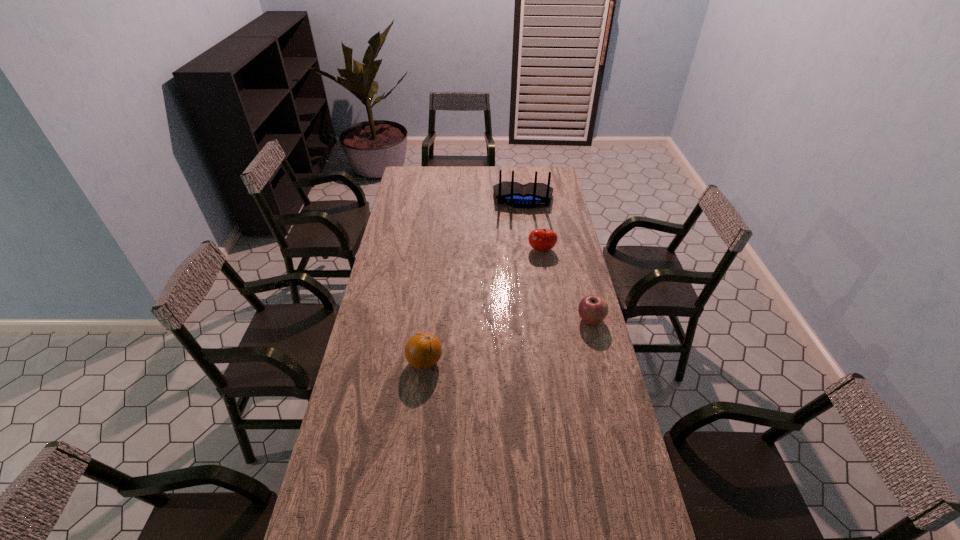
Locate an element on the screen. This screenshot has height=540, width=960. free spot located on the back of the farthest object is located at coordinates (522, 232).

Locate an element on the screen. Image resolution: width=960 pixels, height=540 pixels. vacant region located 0.400m on the back of the farthest object is located at coordinates (522, 260).

Where is `vacant region located on the back of the farthest object`? This screenshot has height=540, width=960. vacant region located on the back of the farthest object is located at coordinates (522, 260).

You are a GUI agent. You are given a task and a screenshot of the screen. Output one action in this format:
    pyautogui.click(x=<x>, y=<y>)
    Task: Click on the vacant region located on the stem of the farther apple
    The image size is (960, 540).
    Given the screenshot: What is the action you would take?
    pyautogui.click(x=531, y=305)

Image resolution: width=960 pixels, height=540 pixels. I want to click on vacant space situated 0.060m on the stem of the farther apple, so click(x=539, y=265).

Where is `blank area located on the stem of the farther apple`? This screenshot has height=540, width=960. blank area located on the stem of the farther apple is located at coordinates (529, 314).

Locate an element on the screen. router present at the right edge is located at coordinates (530, 195).

The image size is (960, 540). Find the location of `vacant space at the far edge of the desktop`. vacant space at the far edge of the desktop is located at coordinates (485, 183).

Locate an element on the screen. This screenshot has height=540, width=960. vacant space at the left edge is located at coordinates (399, 323).

In the image, there is a desktop. Identify the location of blank space at the right edge. The width and height of the screenshot is (960, 540). (555, 310).